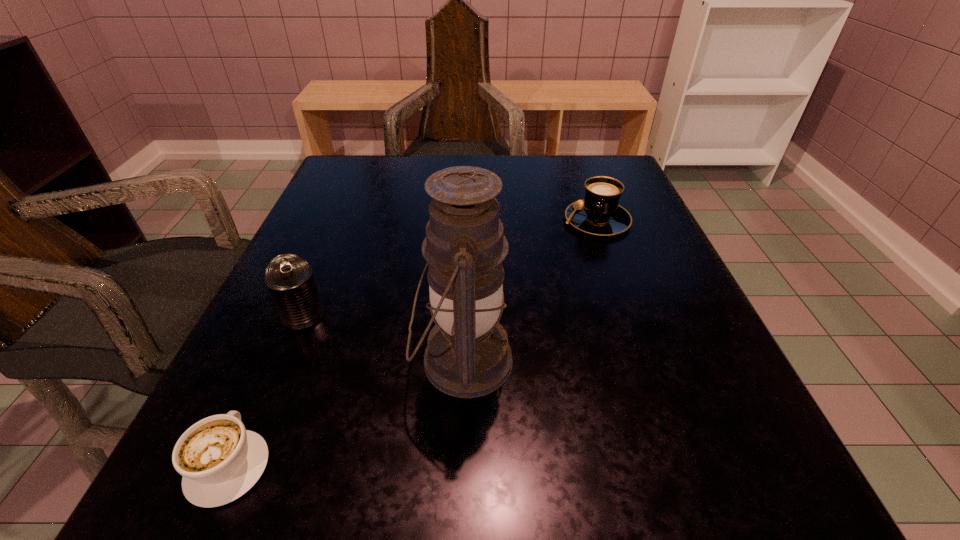
In order to click on blank area at the far edge in this screenshot , I will do `click(460, 158)`.

In the image, there is a desktop. Identify the location of vacant space at the near edge. This screenshot has width=960, height=540. (400, 509).

The height and width of the screenshot is (540, 960). What are the coordinates of `vacant region at the left edge of the desktop` in the screenshot? It's located at pos(275,399).

Identify the location of free space at the right edge of the desktop. (634, 253).

The width and height of the screenshot is (960, 540). In the image, there is a desktop. In order to click on free region at the near left corner in this screenshot , I will do `click(175, 503)`.

Where is `vacant space at the far right corner`? This screenshot has height=540, width=960. vacant space at the far right corner is located at coordinates (561, 165).

In the image, there is a desktop. Where is `vacant space at the near right corner`? vacant space at the near right corner is located at coordinates (691, 448).

At what (x,y) coordinates should I click in order to perform the action: click on vacant area that lies between the shorter cappuccino and the taller cappuccino. Please return your answer as a coordinate pair (x, y). The image size is (960, 540). Looking at the image, I should click on (413, 343).

Locate an element on the screen. This screenshot has width=960, height=540. vacant region between the shortest object and the tallest object is located at coordinates (346, 413).

Locate an element on the screen. The image size is (960, 540). free area in between the left cappuccino and the can is located at coordinates (266, 391).